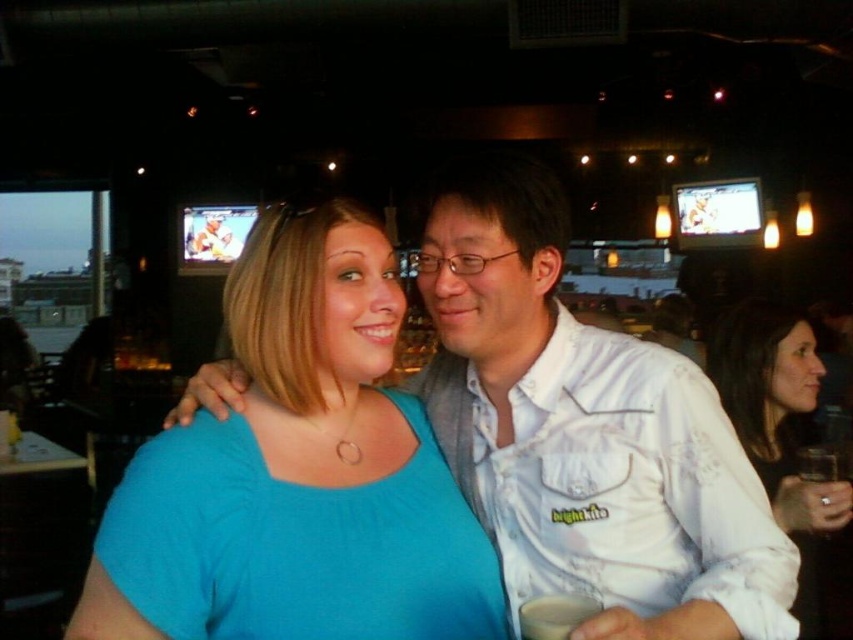
Question: Is white cotton shirt at center positioned behind white lace shirt at right?

Choices:
 (A) yes
 (B) no

Answer: (B)

Question: Which point is closer to the camera?

Choices:
 (A) white matte cup at center
 (B) white lace shirt at right
 (C) matte blue shirt at center
 (D) white cotton shirt at center

Answer: (D)

Question: Which object is positioned farthest from the matte blue shirt at center?

Choices:
 (A) white lace shirt at right
 (B) white cotton shirt at center

Answer: (A)

Question: Considering the relative positions of matte blue shirt at center and white lace shirt at right in the image provided, where is matte blue shirt at center located with respect to white lace shirt at right?

Choices:
 (A) above
 (B) below

Answer: (A)

Question: Based on their relative distances, which object is farther from the white matte cup at center?

Choices:
 (A) white cotton shirt at center
 (B) matte blue shirt at center
 (C) white lace shirt at right

Answer: (C)

Question: Is white cotton shirt at center positioned at the back of white lace shirt at right?

Choices:
 (A) no
 (B) yes

Answer: (A)